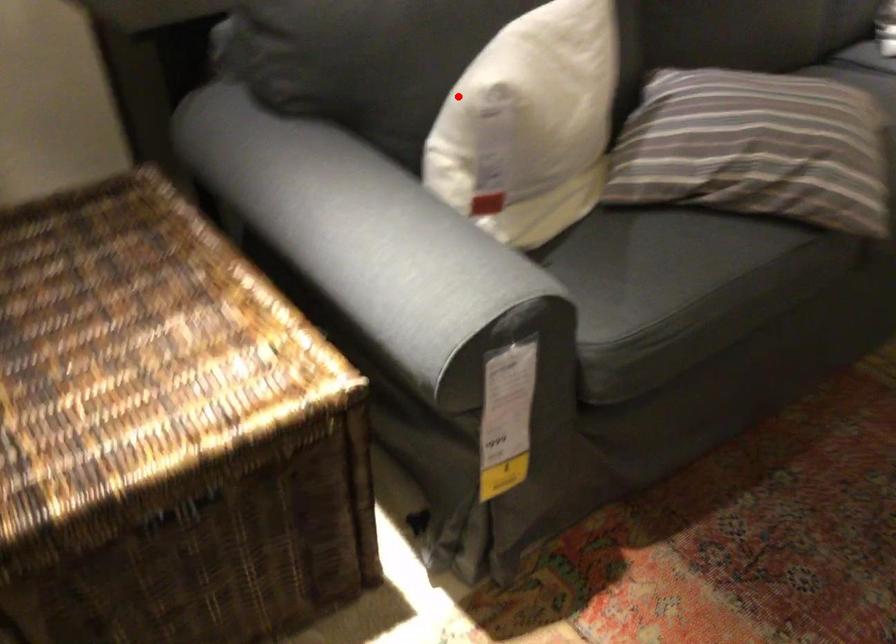
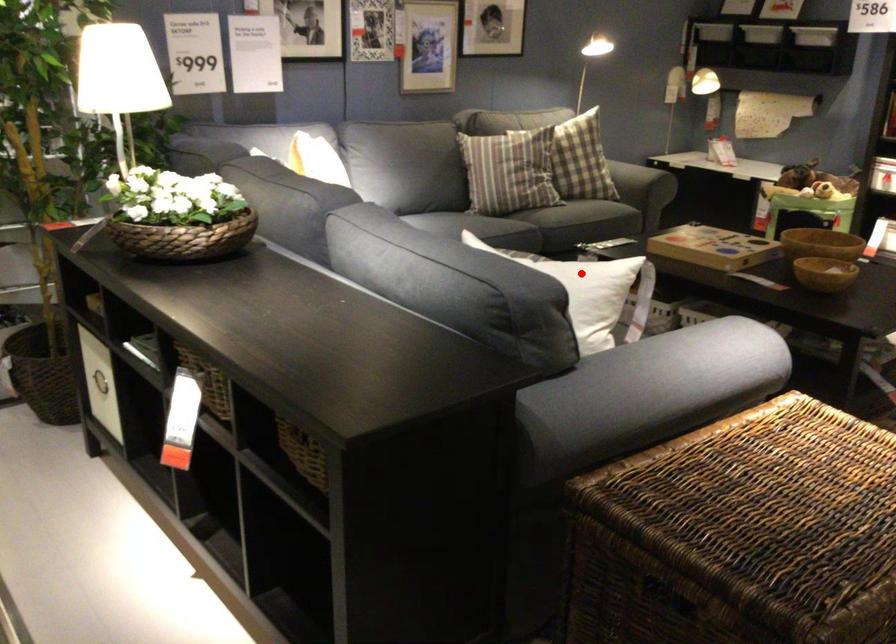
I am providing you with two images of the same scene from different viewpoints. A red point is marked on the first image and another point is marked on the second image. Does the point marked in image1 correspond to the same location as the one in image2?

Yes